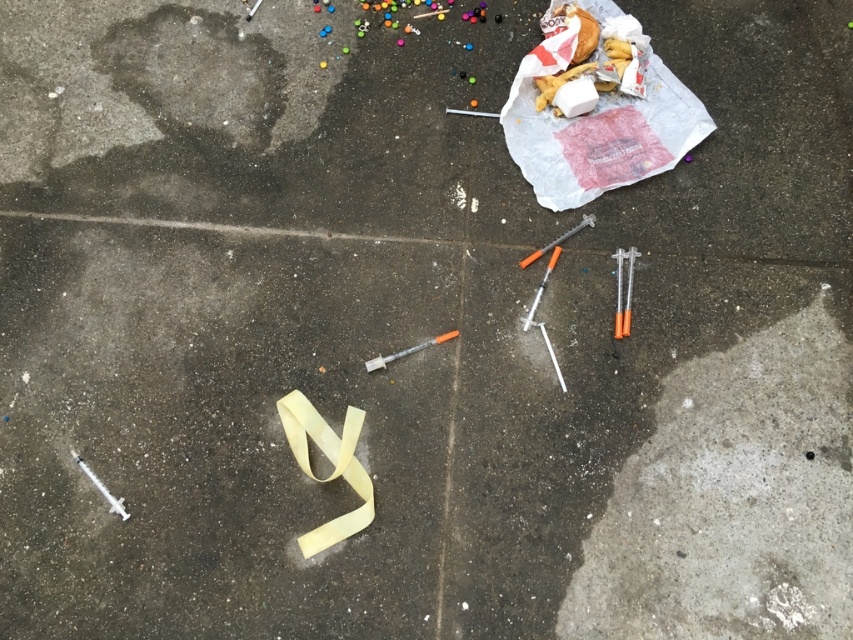
Who is more forward, (367,362) or (543,252)?

Positioned in front is point (367,362).

Is translucent plastic syringe at center further to the viewer compared to matte gray needle at center?

That is False.

Is point (370, 364) farther from camera compared to point (579, 221)?

No, (370, 364) is closer to viewer.

Locate an element on the screen. translucent plastic syringe at center is located at coordinates (407, 352).

Is translucent plastic syringe at center right to the left of metallic silver needle at center from the viewer's perspective?

Incorrect, translucent plastic syringe at center right is not on the left side of metallic silver needle at center.

The image size is (853, 640). In order to click on translucent plastic syringe at center right in this screenshot , I will do (621, 291).

Can you confirm if clear plastic needle at center is positioned to the left of metallic silver needle at center?

Indeed, clear plastic needle at center is positioned on the left side of metallic silver needle at center.

Can you confirm if clear plastic needle at center is shorter than metallic silver needle at center?

In fact, clear plastic needle at center may be taller than metallic silver needle at center.

Where is `clear plastic needle at center`? This screenshot has width=853, height=640. clear plastic needle at center is located at coordinates (541, 288).

Where is `clear plastic needle at center`? Image resolution: width=853 pixels, height=640 pixels. clear plastic needle at center is located at coordinates (541, 288).